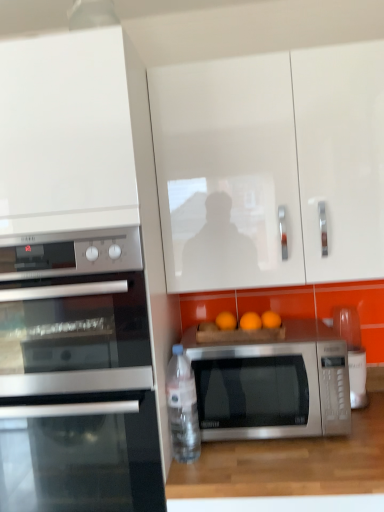
Question: In terms of width, does satin black oven at left look wider or thinner when compared to white glossy cabinet at upper left, which is the 2th cabinetry from right to left?

Choices:
 (A) wide
 (B) thin

Answer: (B)

Question: Is satin black oven at left to the left or to the right of white glossy cabinet at upper left, which appears as the first cabinetry when viewed from the left, in the image?

Choices:
 (A) right
 (B) left

Answer: (A)

Question: Which object is the closest to the white glossy cabinet at upper left, which appears as the first cabinetry when viewed from the left?

Choices:
 (A) satin silver microwave at left, positioned as the 1th microwave oven in left-to-right order
 (B) clear plastic bottle at lower center
 (C) white glossy microwave at right
 (D) wooden at lower center
 (E) satin silver microwave at center, placed as the first microwave oven when sorted from right to left

Answer: (A)

Question: Which object is the farthest from the white glossy cabinet at upper center, placed as the 2th cabinetry when sorted from left to right?

Choices:
 (A) white glossy microwave at right
 (B) wooden at lower center
 (C) satin silver microwave at center, placed as the first microwave oven when sorted from right to left
 (D) clear plastic bottle at lower center
 (E) white glossy cabinet at upper left, which is the 2th cabinetry from right to left

Answer: (B)